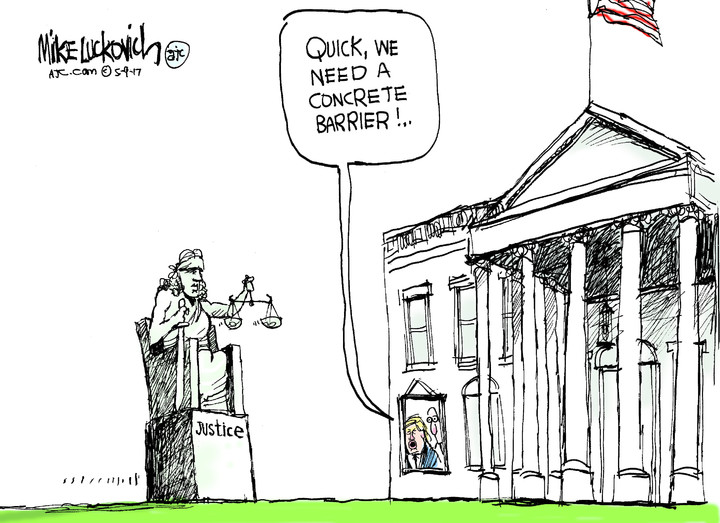
This screenshot has width=720, height=523. Identify the location of cartoon weight measuring scale. (250, 295).